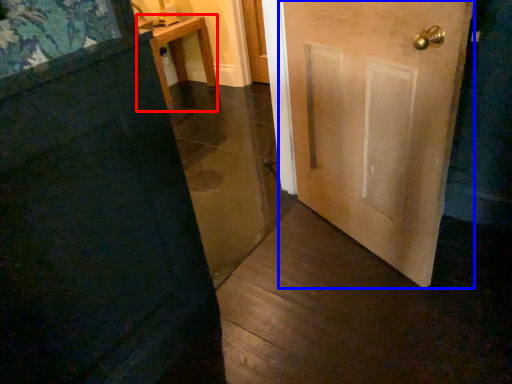
Question: Among these objects, which one is nearest to the camera, furniture (highlighted by a red box) or door (highlighted by a blue box)?

Choices:
 (A) furniture
 (B) door

Answer: (B)